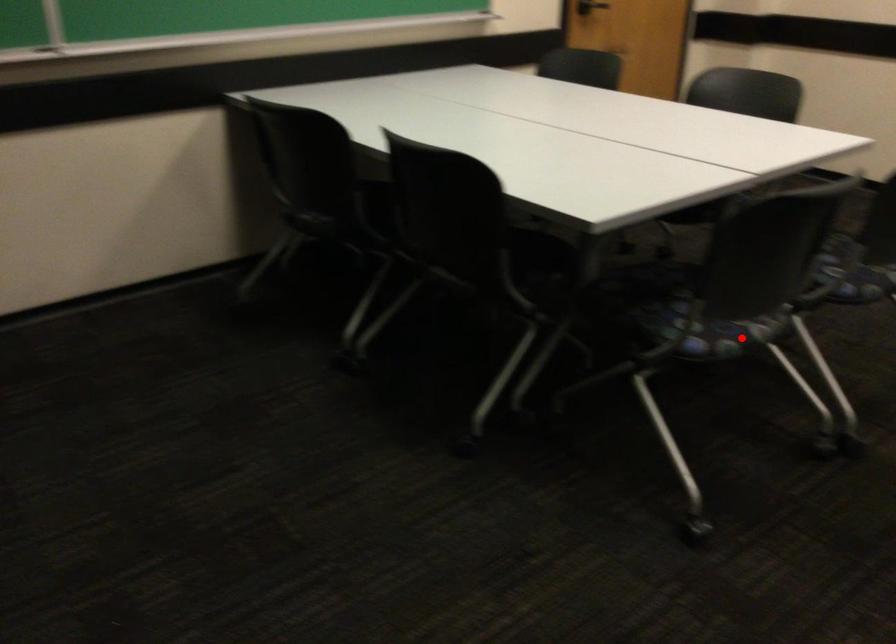
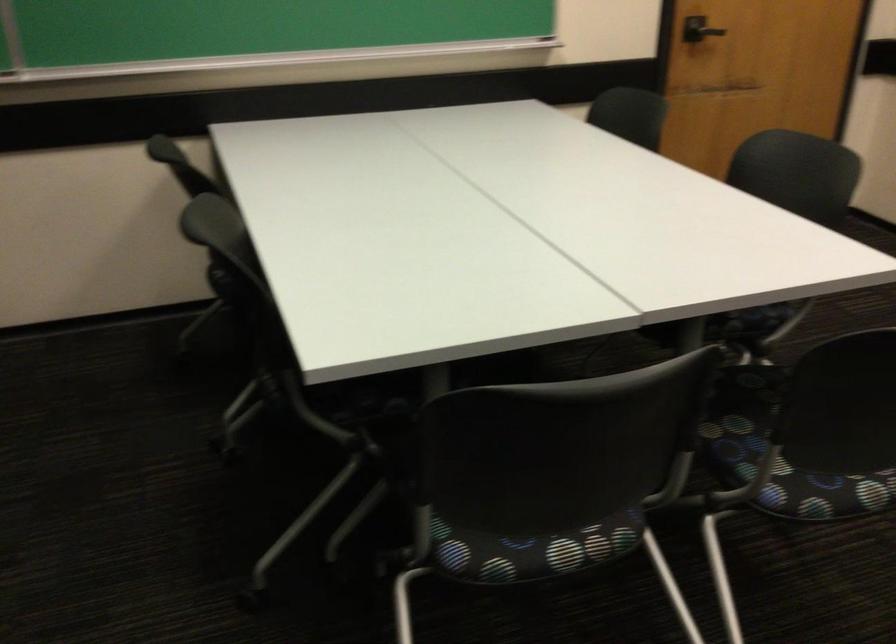
Locate, in the second image, the point that corresponds to the highlighted location in the first image.

(531, 550)